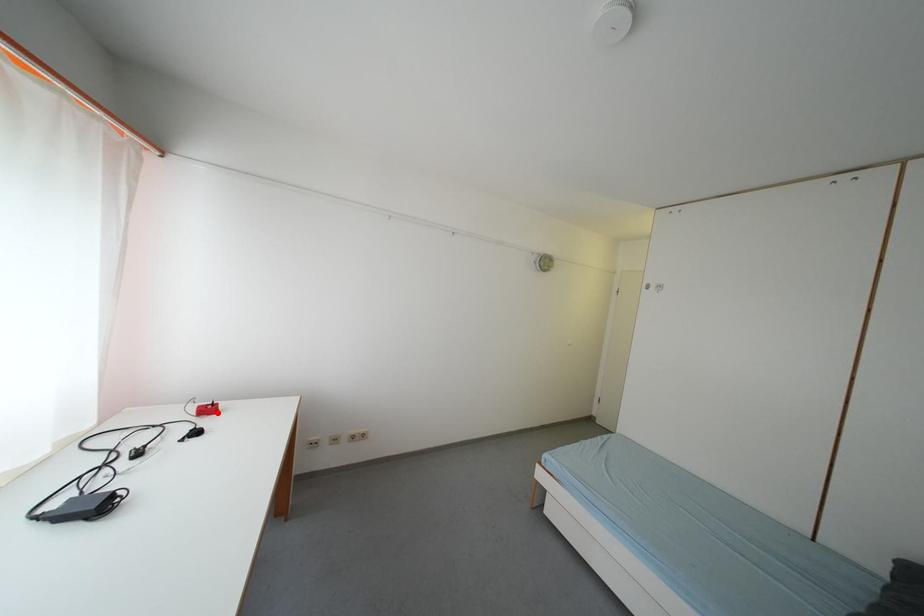
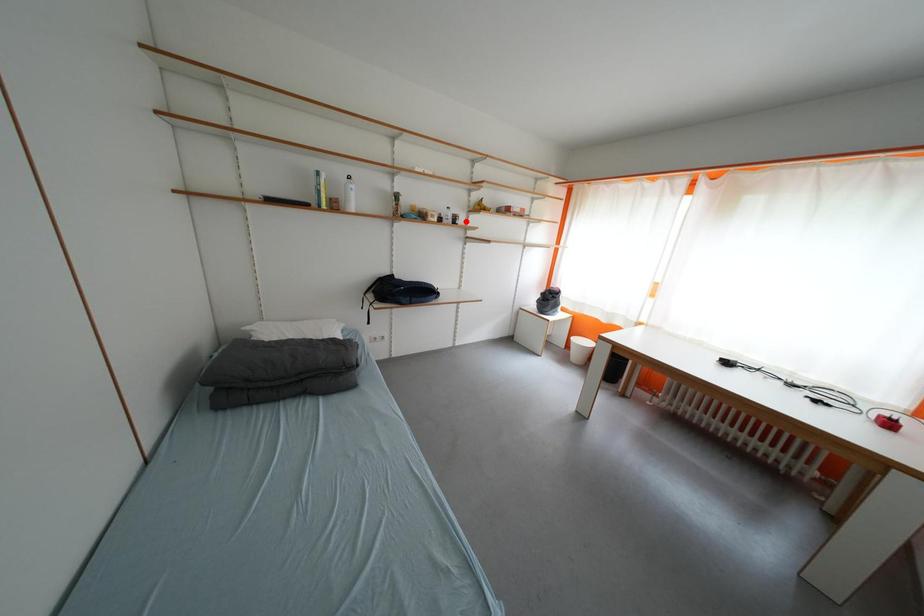
I am providing you with two images of the same scene from different viewpoints. A red point is marked on the first image and another point is marked on the second image. Does the point marked in image1 correspond to the same location as the one in image2?

No